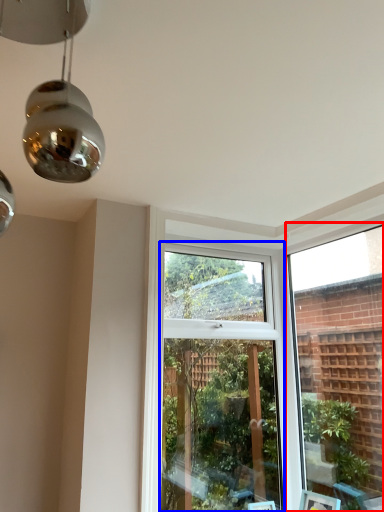
Question: Which object appears closest to the camera in this image, window frame (highlighted by a red box) or window (highlighted by a blue box)?

Choices:
 (A) window frame
 (B) window

Answer: (A)